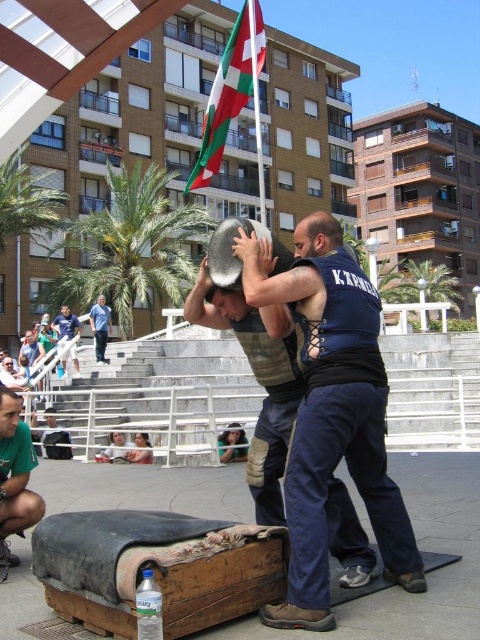
Can you confirm if green fabric man at lower left is positioned to the left of blue denim jeans at lower left?

No, green fabric man at lower left is not to the left of blue denim jeans at lower left.

Is green fabric man at lower left below blue denim jeans at lower left?

Correct, green fabric man at lower left is located below blue denim jeans at lower left.

Identify the location of green fabric man at lower left. Image resolution: width=480 pixels, height=640 pixels. (15, 474).

Is green and white fabric flag at upper center positioned in front of blue denim jeans at lower left?

That is True.

Is point (216, 83) less distant than point (61, 336)?

Yes, it is.

Describe the element at coordinates (231, 93) in the screenshot. I see `green and white fabric flag at upper center` at that location.

I want to click on green and white fabric flag at upper center, so click(231, 93).

Who is more distant from viewer, [92,326] or [69,326]?

The point [92,326] is more distant.

Is point (99, 346) closer to viewer compared to point (64, 328)?

Yes, point (99, 346) is closer to viewer.

Locate an element on the screen. blue cotton shirt at lower left is located at coordinates (99, 326).